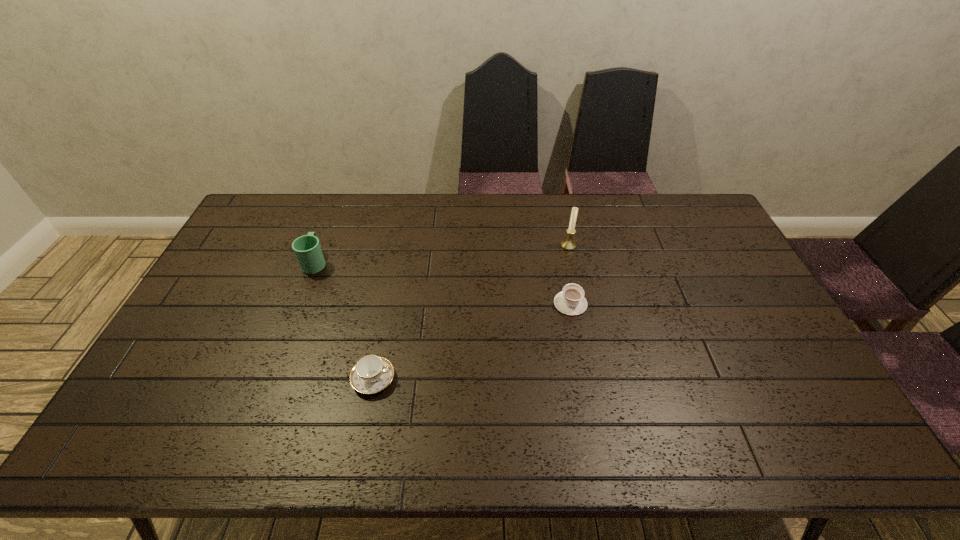
You are a GUI agent. You are given a task and a screenshot of the screen. Output one action in this format:
    pyautogui.click(x=<x>, y=<y>)
    Task: Click on the free space located on the side of the second tallest object with the handle
    The height and width of the screenshot is (540, 960).
    Given the screenshot: What is the action you would take?
    pyautogui.click(x=340, y=199)

You are a GUI agent. You are given a task and a screenshot of the screen. Output one action in this format:
    pyautogui.click(x=<x>, y=<y>)
    Task: Click on the free space located 0.140m on the side with the handle of the nearer teacup
    Image resolution: width=960 pixels, height=540 pixels.
    Given the screenshot: What is the action you would take?
    pyautogui.click(x=448, y=379)

Locate an element on the screen. vacant space located on the handle side of the third farthest object is located at coordinates (556, 227).

Locate an element on the screen. The image size is (960, 540). vacant space located on the handle side of the third farthest object is located at coordinates (559, 241).

You are a GUI agent. You are given a task and a screenshot of the screen. Output one action in this format:
    pyautogui.click(x=<x>, y=<y>)
    Task: Click on the free location located on the handle side of the third farthest object
    This screenshot has height=540, width=960.
    Given the screenshot: What is the action you would take?
    pyautogui.click(x=558, y=239)

What are the coordinates of `vacant space at the far edge` in the screenshot? It's located at (527, 212).

Locate an element on the screen. free region at the near edge of the desktop is located at coordinates (437, 456).

Locate an element on the screen. The image size is (960, 540). vacant space at the left edge of the desktop is located at coordinates 261,249.

The height and width of the screenshot is (540, 960). In the image, there is a desktop. Find the location of `blank space at the right edge`. blank space at the right edge is located at coordinates (719, 314).

The image size is (960, 540). In the image, there is a desktop. In order to click on vacant area at the near left corner in this screenshot , I will do `click(140, 426)`.